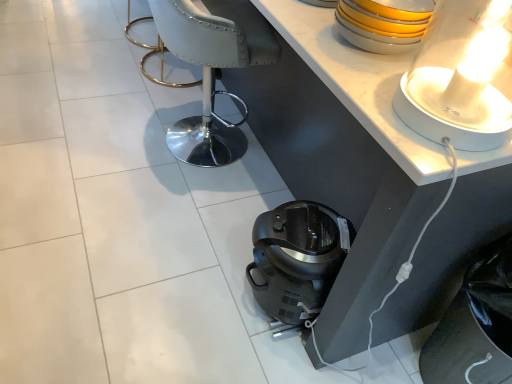
Question: Is point (402, 34) closer or farther from the camera than point (219, 144)?

Choices:
 (A) farther
 (B) closer

Answer: (B)

Question: Considering their positions, is yellow glossy bowls at upper right located in front of or behind white leather armchair at center?

Choices:
 (A) behind
 (B) front

Answer: (B)

Question: Based on their relative distances, which object is farther from the white glossy table at upper center?

Choices:
 (A) white leather armchair at center
 (B) satin black coffee maker at lower center
 (C) white glossy lamp at upper right
 (D) yellow glossy bowls at upper right

Answer: (A)

Question: Which object is the farthest from the satin black coffee maker at lower center?

Choices:
 (A) white glossy lamp at upper right
 (B) yellow glossy bowls at upper right
 (C) white glossy table at upper center
 (D) white leather armchair at center

Answer: (D)